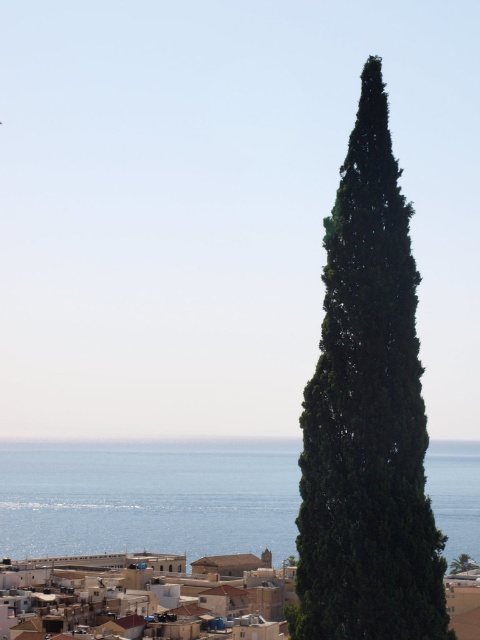
You are standing on the beach and see the green leafy cypress at center and the blue liquid water at center. Which object is located to the right of the other?

The green leafy cypress at center is positioned on the right side of blue liquid water at center.

You are standing at the edge of the sea in this coastal scene. You see the green leafy cypress at center and the blue liquid water at center. Which object is taller?

The blue liquid water at center is taller than the green leafy cypress at center according to the description.